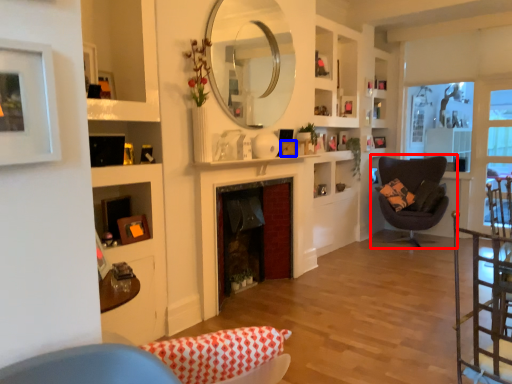
Question: Which object appears farthest to the camera in this image, chair (highlighted by a red box) or picture frame (highlighted by a blue box)?

Choices:
 (A) chair
 (B) picture frame

Answer: (A)